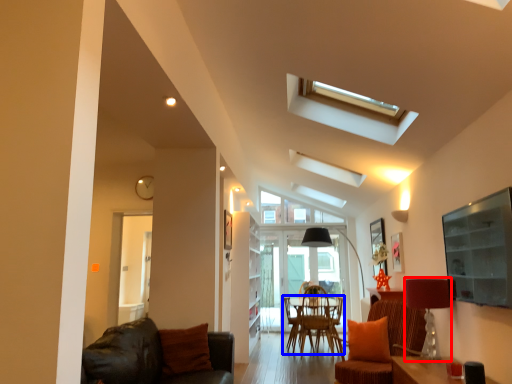
Question: Which point is closer to the camera, lamp (highlighted by a red box) or chair (highlighted by a blue box)?

Choices:
 (A) lamp
 (B) chair

Answer: (A)